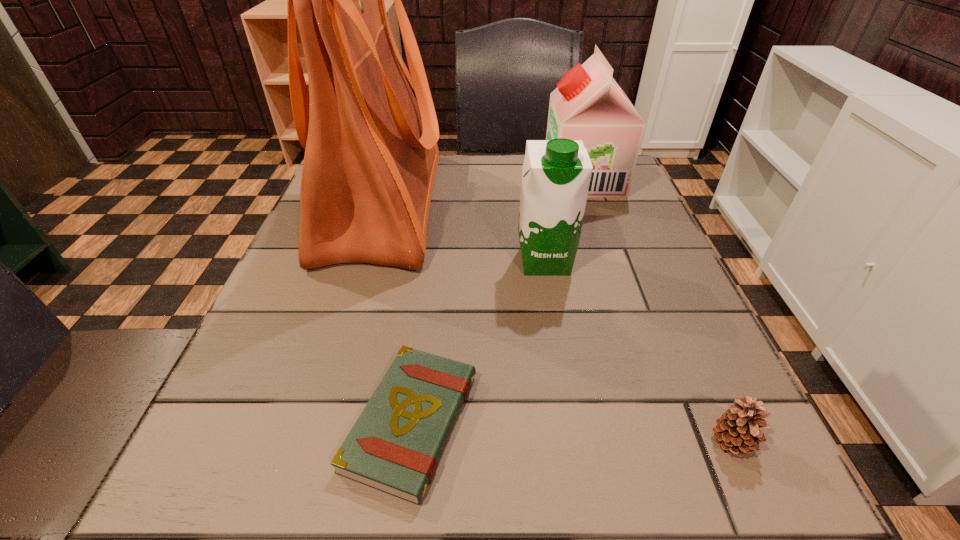
Find the location of a particular element. Image resolution: width=960 pixels, height=540 pixels. shopping bag is located at coordinates (369, 129).

This screenshot has width=960, height=540. What are the coordinates of `the farther soya milk` in the screenshot? It's located at (588, 104).

The height and width of the screenshot is (540, 960). I want to click on the nearer soya milk, so coord(556,173).

Locate an element on the screen. This screenshot has width=960, height=540. pinecone is located at coordinates (737, 429).

The width and height of the screenshot is (960, 540). In order to click on the shortest object in this screenshot , I will do `click(394, 446)`.

Identify the location of vacant space located on the front pocket of the shopping bag. (486, 205).

The image size is (960, 540). Identify the location of vacant space located 0.240m with the cap open on the farther soya milk. (450, 179).

Where is `vacant space located with the cap open on the farther soya milk`? vacant space located with the cap open on the farther soya milk is located at coordinates (414, 179).

Find the location of a particular element. The width and height of the screenshot is (960, 540). free space located with the cap open on the farther soya milk is located at coordinates (519, 179).

What are the coordinates of `vacant region located on the front-facing side of the nearer soya milk` in the screenshot? It's located at [579, 460].